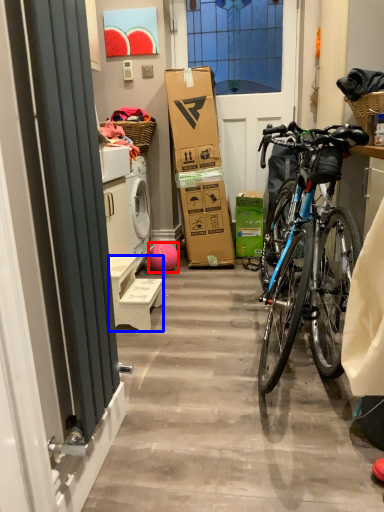
Question: Which point is further to the camera, ball (highlighted by a red box) or furniture (highlighted by a blue box)?

Choices:
 (A) ball
 (B) furniture

Answer: (A)